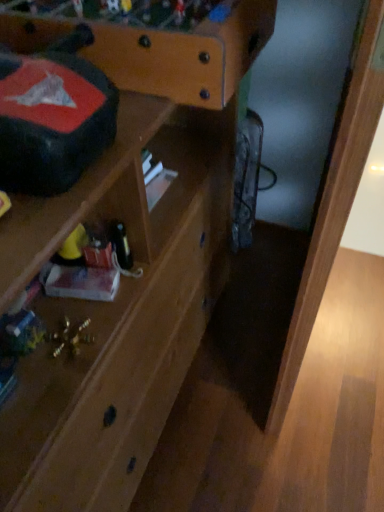
The height and width of the screenshot is (512, 384). Find the location of `matte black writing desk at upper left`. matte black writing desk at upper left is located at coordinates (185, 55).

Locate an element on the screen. This screenshot has width=384, height=512. light brown wood at lower right is located at coordinates (334, 201).

Could you tell me if light brown wood at lower right is turned towards wooden shelf at center?

No, light brown wood at lower right is not aimed at wooden shelf at center.

Which object is positioned more to the left, light brown wood at lower right or wooden shelf at center?

wooden shelf at center.

Considering the points (295, 379) and (115, 435), which point is behind, point (295, 379) or point (115, 435)?

Point (295, 379)

Is point (48, 407) less distant than point (194, 50)?

Yes, it is in front of point (194, 50).

From the picture: Is wooden shelf at center not near matte black writing desk at upper left?

wooden shelf at center is actually quite close to matte black writing desk at upper left.

Is wooden shelf at center completely or partially outside of matte black writing desk at upper left?

That's correct, wooden shelf at center is outside of matte black writing desk at upper left.

Would you say wooden shelf at center is to the left or to the right of matte black writing desk at upper left in the picture?

wooden shelf at center is positioned on matte black writing desk at upper left's left side.

Between light brown wood at lower right and matte black writing desk at upper left, which one is positioned behind?

Positioned behind is matte black writing desk at upper left.

Considering the positions of objects light brown wood at lower right and matte black writing desk at upper left in the image provided, who is more to the right, light brown wood at lower right or matte black writing desk at upper left?

light brown wood at lower right is more to the right.

Is light brown wood at lower right completely or partially outside of matte black writing desk at upper left?

Indeed, light brown wood at lower right is completely outside matte black writing desk at upper left.

Considering the sizes of light brown wood at lower right and matte black writing desk at upper left in the image, is light brown wood at lower right wider or thinner than matte black writing desk at upper left?

light brown wood at lower right is thinner than matte black writing desk at upper left.

Does point (24, 40) appear closer or farther from the camera than point (129, 93)?

Clearly, point (24, 40) is closer to the camera than point (129, 93).

Which of these two, matte black writing desk at upper left or wooden shelf at center, is bigger?

wooden shelf at center.

Considering the relative sizes of matte black writing desk at upper left and wooden shelf at center in the image provided, is matte black writing desk at upper left wider than wooden shelf at center?

Yes.

Visually, is matte black writing desk at upper left positioned to the left or to the right of wooden shelf at center?

matte black writing desk at upper left is positioned on wooden shelf at center's right side.

How much distance is there between wooden shelf at center and light brown wood at lower right?

wooden shelf at center is 12.12 inches from light brown wood at lower right.

Between wooden shelf at center and light brown wood at lower right, which one appears on the left side from the viewer's perspective?

From the viewer's perspective, wooden shelf at center appears more on the left side.

What's the angular difference between wooden shelf at center and light brown wood at lower right's facing directions?

wooden shelf at center and light brown wood at lower right are facing 1.47 degrees away from each other.

Identify the location of wood above the wooden shelf at center (from the image's perspective). (334, 201).

Can you confirm if matte black writing desk at upper left is positioned to the left of light brown wood at lower right?

Yes.

Who is taller, matte black writing desk at upper left or light brown wood at lower right?

Standing taller between the two is light brown wood at lower right.

From the image's perspective, relative to light brown wood at lower right, is matte black writing desk at upper left above or below?

Clearly, from the image's perspective, matte black writing desk at upper left is above light brown wood at lower right.

At what (x,y) coordinates should I click in order to perform the action: click on shelf in front of the light brown wood at lower right. Please return your answer as a coordinate pair (x, y). The width and height of the screenshot is (384, 512). Looking at the image, I should click on (131, 254).

Where is `shelf below the matte black writing desk at upper left (from a real-world perspective)`? Image resolution: width=384 pixels, height=512 pixels. shelf below the matte black writing desk at upper left (from a real-world perspective) is located at coordinates (131, 254).

Looking at the image, which one is located closer to light brown wood at lower right, wooden shelf at center or matte black writing desk at upper left?

Among the two, matte black writing desk at upper left is located nearer to light brown wood at lower right.

Based on their spatial positions, is matte black writing desk at upper left or wooden shelf at center closer to light brown wood at lower right?

matte black writing desk at upper left.

Based on their spatial positions, is light brown wood at lower right or matte black writing desk at upper left further from wooden shelf at center?

Among the two, light brown wood at lower right is located further to wooden shelf at center.

Looking at this image, based on their spatial positions, is wooden shelf at center or light brown wood at lower right further from matte black writing desk at upper left?

light brown wood at lower right.

Considering their positions, is light brown wood at lower right positioned further to matte black writing desk at upper left than wooden shelf at center?

The object further to matte black writing desk at upper left is light brown wood at lower right.

Based on their spatial positions, is matte black writing desk at upper left or light brown wood at lower right closer to wooden shelf at center?

The object closer to wooden shelf at center is matte black writing desk at upper left.

What are the coordinates of `writing desk between wooden shelf at center and light brown wood at lower right from left to right` in the screenshot? It's located at (185, 55).